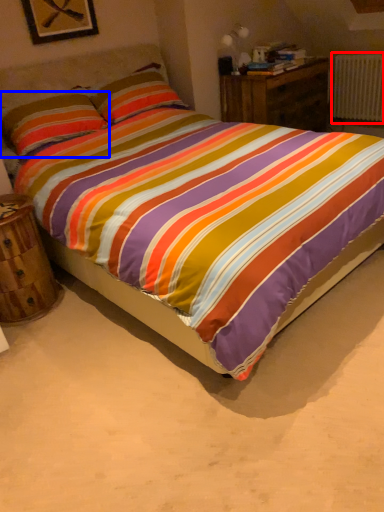
Question: Among these objects, which one is nearest to the camera, radiator (highlighted by a red box) or pillow (highlighted by a blue box)?

Choices:
 (A) radiator
 (B) pillow

Answer: (B)